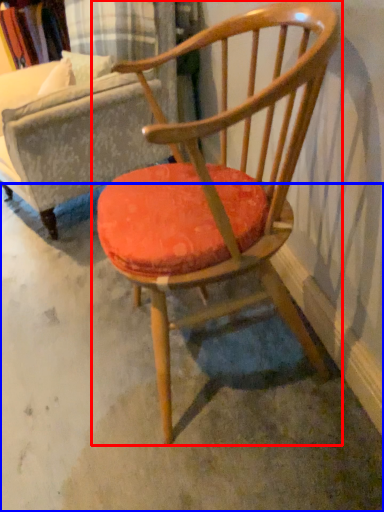
Question: Among these objects, which one is nearest to the camera, chair (highlighted by a red box) or concrete (highlighted by a blue box)?

Choices:
 (A) chair
 (B) concrete

Answer: (A)